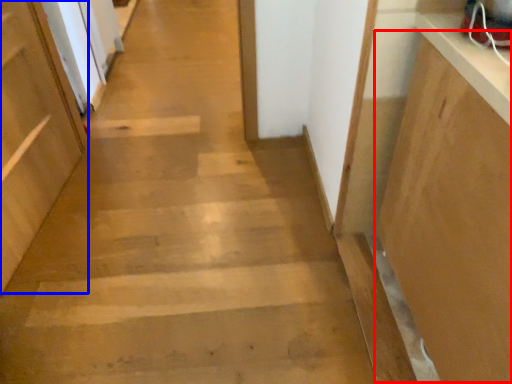
Question: Among these objects, which one is nearest to the camera, cabinetry (highlighted by a red box) or door (highlighted by a blue box)?

Choices:
 (A) cabinetry
 (B) door

Answer: (A)